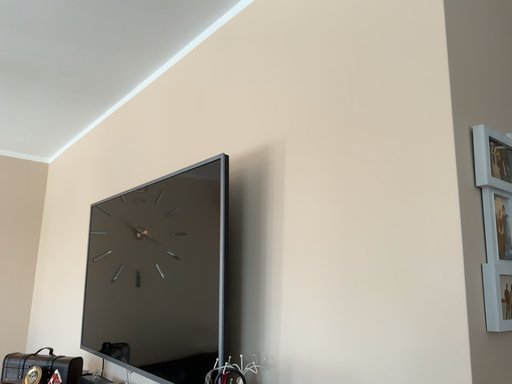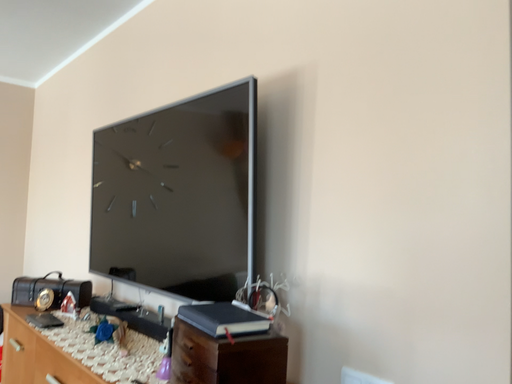
Question: How did the camera likely rotate when shooting the video?

Choices:
 (A) rotated upward
 (B) rotated downward

Answer: (B)